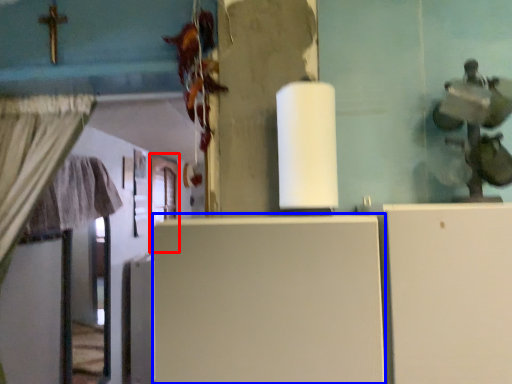
Question: Which of the following is the farthest to the observer, door (highlighted by a red box) or fridge (highlighted by a blue box)?

Choices:
 (A) door
 (B) fridge

Answer: (A)